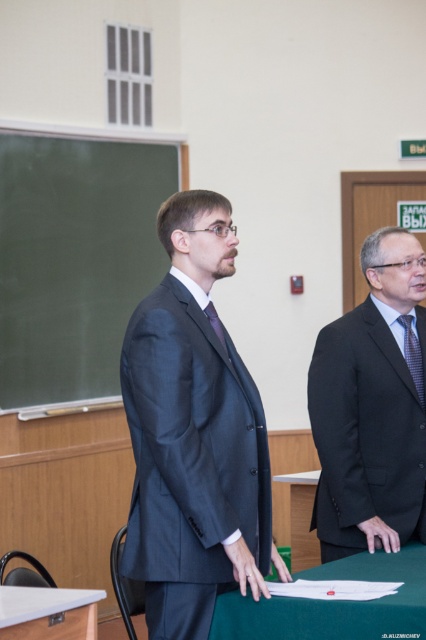
Which is in front, point (161, 397) or point (339, 372)?

Point (161, 397) is in front.

The height and width of the screenshot is (640, 426). In order to click on dark blue suit at center in this screenshot , I will do `click(193, 433)`.

Does dark blue suit at center appear under green fabric table at center?

No, dark blue suit at center is not below green fabric table at center.

Looking at this image, between dark blue suit at center and green fabric table at center, which one appears on the right side from the viewer's perspective?

From the viewer's perspective, green fabric table at center appears more on the right side.

Between point (233, 456) and point (229, 612), which one is positioned in front?

Point (229, 612)

Where is `dark blue suit at center`? Image resolution: width=426 pixels, height=640 pixels. dark blue suit at center is located at coordinates (193, 433).

Does dark gray suit at right appear on the right side of green laminate table at lower left?

Yes, dark gray suit at right is to the right of green laminate table at lower left.

Can you confirm if dark gray suit at right is smaller than green laminate table at lower left?

No.

Measure the distance between point (420,308) and camera.

Point (420,308) is 3.53 meters away from camera.

Find the location of `dark gray suit at right`. dark gray suit at right is located at coordinates (371, 406).